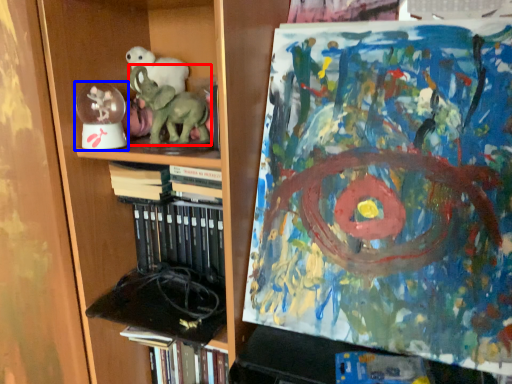
Question: Which of the following is the closest to the observer, elephant (highlighted by a red box) or toy (highlighted by a blue box)?

Choices:
 (A) elephant
 (B) toy

Answer: (A)